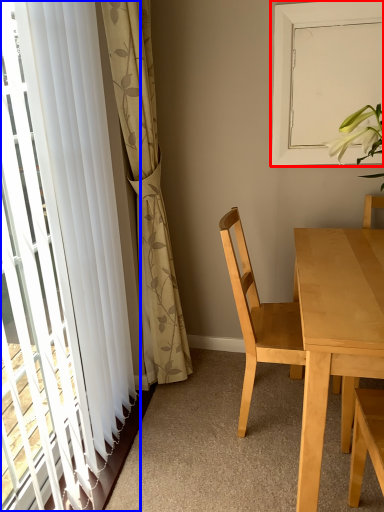
Question: Among these objects, which one is farthest to the camera, window screen (highlighted by a red box) or curtain (highlighted by a blue box)?

Choices:
 (A) window screen
 (B) curtain

Answer: (A)